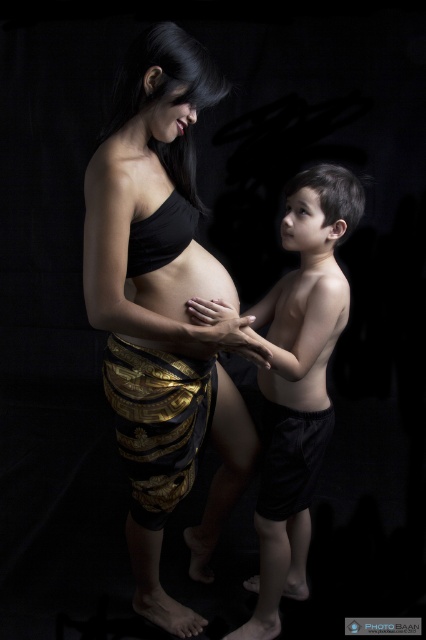
Looking at this image, you are a photographer who wants to ensure both the smooth skin boy at center and the matte skin at center are clearly visible in the photo. Given their sizes, which one might require more careful framing to avoid being too small in the shot?

The matte skin at center has a smaller width than the smooth skin boy at center, so it might require more careful framing to avoid being too small in the shot.

You are a photographer who needs to ensure the lighting is appropriate for both the smooth skin boy at center and the matte skin at center in the image. Which subject might require more diffused lighting to avoid harsh shadows?

The smooth skin boy at center might require more diffused lighting since it is bigger than the matte skin at center, and smooth surfaces typically reflect more light, leading to harsher shadows which can be mitigated with diffused lighting.